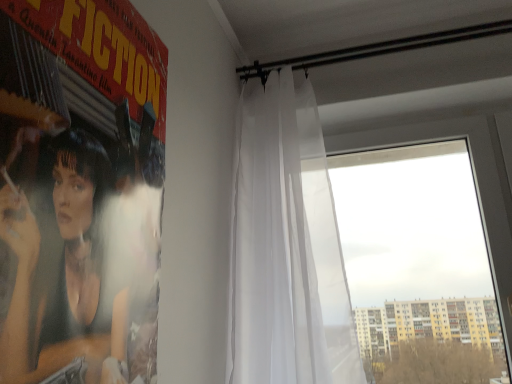
Question: From a real-world perspective, is matte black poster at left beneath transparent glass window at right?

Choices:
 (A) no
 (B) yes

Answer: (B)

Question: Is matte black poster at left wider than transparent glass window at right?

Choices:
 (A) no
 (B) yes

Answer: (A)

Question: Is matte black poster at left positioned with its back to transparent glass window at right?

Choices:
 (A) no
 (B) yes

Answer: (A)

Question: From the image's perspective, does matte black poster at left appear higher than transparent glass window at right?

Choices:
 (A) no
 (B) yes

Answer: (B)

Question: Is matte black poster at left closer to camera compared to transparent glass window at right?

Choices:
 (A) yes
 (B) no

Answer: (A)

Question: Is matte black poster at left to the left of transparent glass window at right from the viewer's perspective?

Choices:
 (A) no
 (B) yes

Answer: (B)

Question: Is transparent glass window at right positioned in front of matte black poster at left?

Choices:
 (A) yes
 (B) no

Answer: (B)

Question: Considering the relative positions of transparent glass window at right and matte black poster at left in the image provided, is transparent glass window at right to the left of matte black poster at left from the viewer's perspective?

Choices:
 (A) yes
 (B) no

Answer: (B)

Question: Is transparent glass window at right aimed at matte black poster at left?

Choices:
 (A) no
 (B) yes

Answer: (B)

Question: Is transparent glass window at right thinner than matte black poster at left?

Choices:
 (A) no
 (B) yes

Answer: (A)

Question: From the image's perspective, is transparent glass window at right below matte black poster at left?

Choices:
 (A) no
 (B) yes

Answer: (B)

Question: From the image's perspective, would you say transparent glass window at right is positioned over matte black poster at left?

Choices:
 (A) no
 (B) yes

Answer: (A)

Question: Considering the relative positions of white sheer curtain at upper center and transparent glass window at right in the image provided, is white sheer curtain at upper center to the left of transparent glass window at right from the viewer's perspective?

Choices:
 (A) yes
 (B) no

Answer: (A)